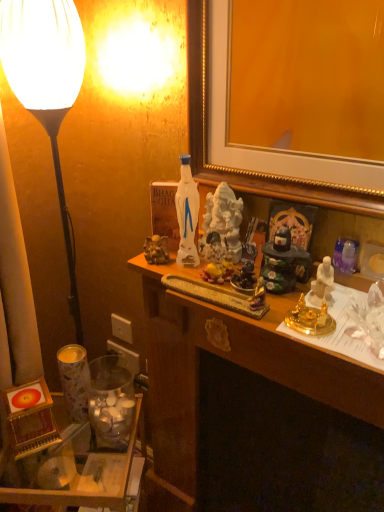
Question: From the image's perspective, is white plastic power outlet at lower left, arranged as the 2th power outlet when viewed from the top, above or below wooden desk at center?

Choices:
 (A) below
 (B) above

Answer: (B)

Question: In terms of width, does white plastic power outlet at lower left, the first power outlet positioned from the bottom, look wider or thinner when compared to wooden desk at center?

Choices:
 (A) wide
 (B) thin

Answer: (B)

Question: Estimate the real-world distances between objects in this image. Which object is closer to the beige plastic power outlet at lower left, which is the 2th power outlet from bottom to top?

Choices:
 (A) translucent glass jar at lower left
 (B) translucent glass jar at lower left
 (C) white plastic power outlet at lower left, the first power outlet positioned from the bottom
 (D) wooden desk at center
 (E) white matte lamp at left

Answer: (C)

Question: Which object is positioned closest to the translucent glass jar at lower left?

Choices:
 (A) white plastic power outlet at lower left, the first power outlet positioned from the bottom
 (B) white matte lamp at left
 (C) wooden desk at center
 (D) beige plastic power outlet at lower left, which appears as the first power outlet when viewed from the top
 (E) translucent glass jar at lower left

Answer: (E)